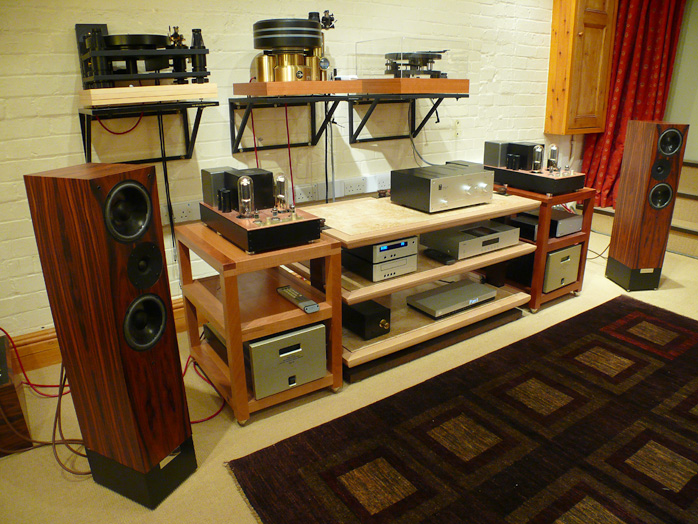
This screenshot has width=698, height=524. Identify the location of center wall shelf. pyautogui.click(x=294, y=96).